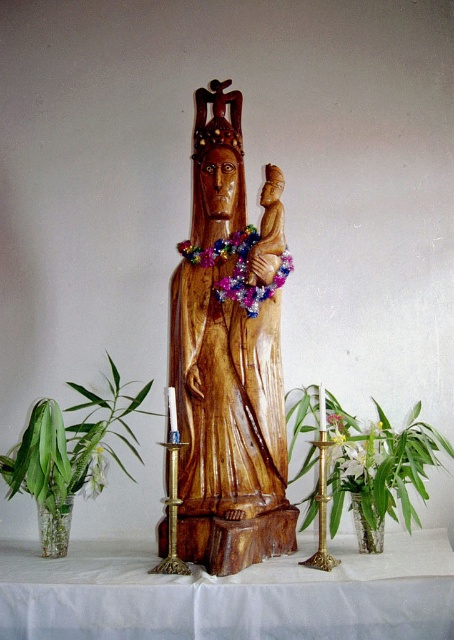
Does metallic garland at center come in front of gold polished candlestick at center?

No, it is behind gold polished candlestick at center.

From the picture: Who is positioned more to the right, metallic garland at center or gold polished candlestick at center?

Positioned to the right is metallic garland at center.

Which is in front, point (208, 264) or point (177, 445)?

Point (177, 445) is more forward.

In order to click on metallic garland at center in this screenshot , I will do `click(237, 268)`.

Which is in front, point (355, 444) or point (321, 387)?

Point (321, 387) is more forward.

What do you see at coordinates (355, 451) in the screenshot? I see `white glossy flower at center right` at bounding box center [355, 451].

Is point (336, 461) behind point (320, 566)?

Yes, point (336, 461) is behind point (320, 566).

Image resolution: width=454 pixels, height=640 pixels. Identify the location of white glossy flower at center right. (355, 451).

Which of these two, green glass vase at left or green leafy plant at lower right, stands taller?

With more height is green glass vase at left.

Is green glass vase at left thinner than green leafy plant at lower right?

Yes.

Is point (79, 477) less distant than point (403, 509)?

That is False.

The image size is (454, 640). Identify the location of green glass vase at left. (68, 452).